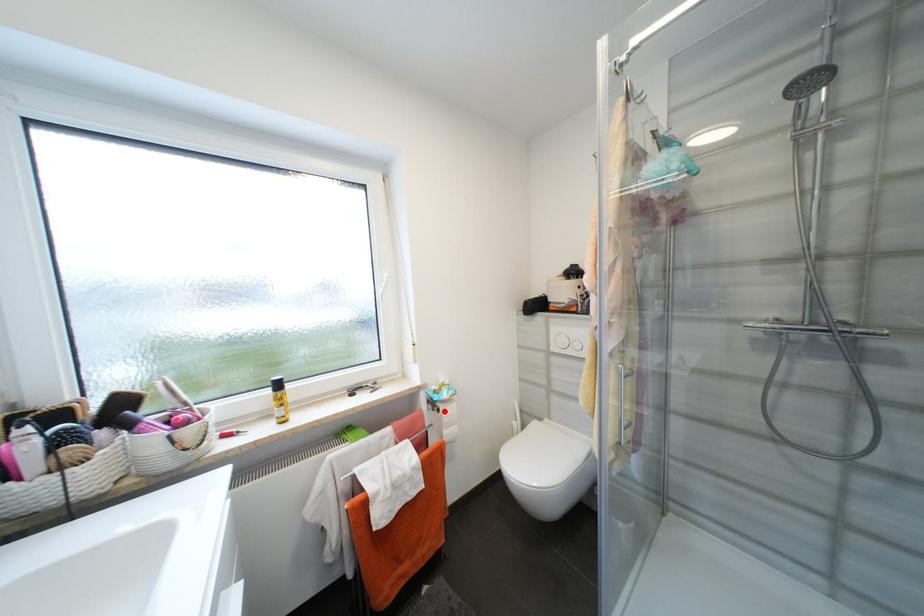
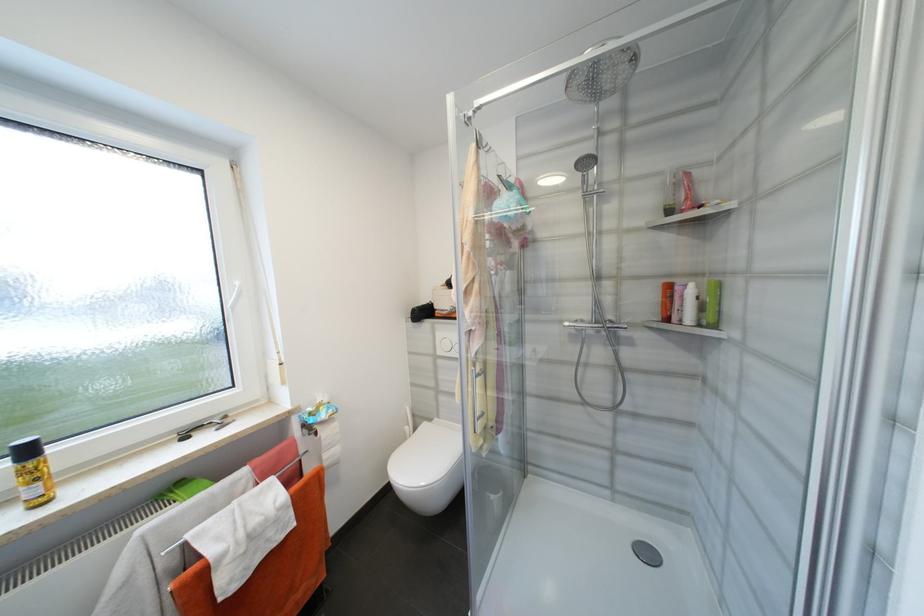
Question: I am providing you with two images of the same scene from different viewpoints. Image1 has a red point marked. In image2, the corresponding 3D location appears at what relative position? Reply with the corresponding letter.

Choices:
 (A) Closer
 (B) Farther

Answer: (A)